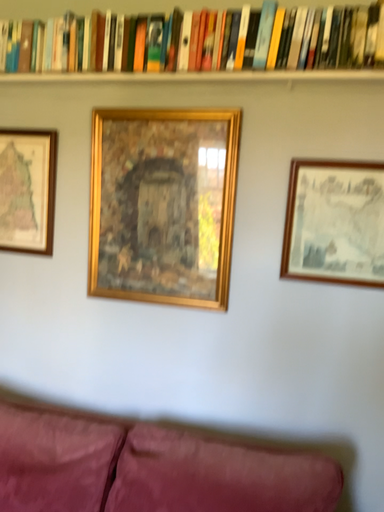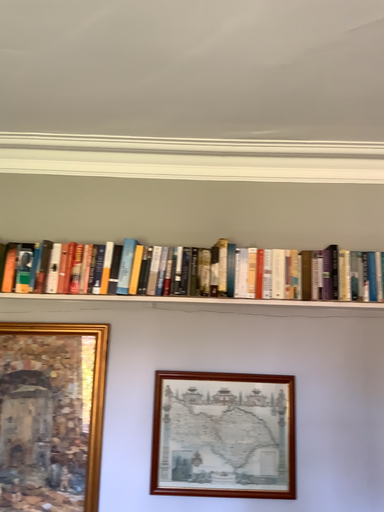
Question: How did the camera likely rotate when shooting the video?

Choices:
 (A) rotated right
 (B) rotated left

Answer: (A)